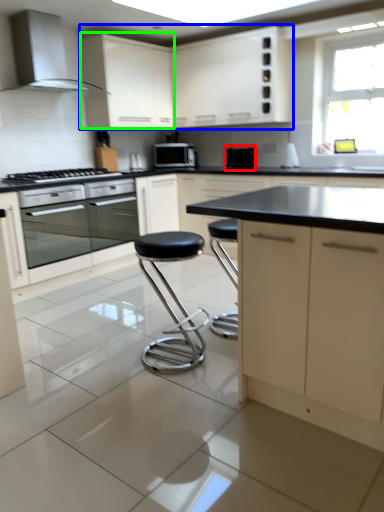
Question: Which object is the closest to the appliance (highlighted by a red box)? Choose among these: cabinetry (highlighted by a blue box) or cabinetry (highlighted by a green box).

Choices:
 (A) cabinetry
 (B) cabinetry

Answer: (A)